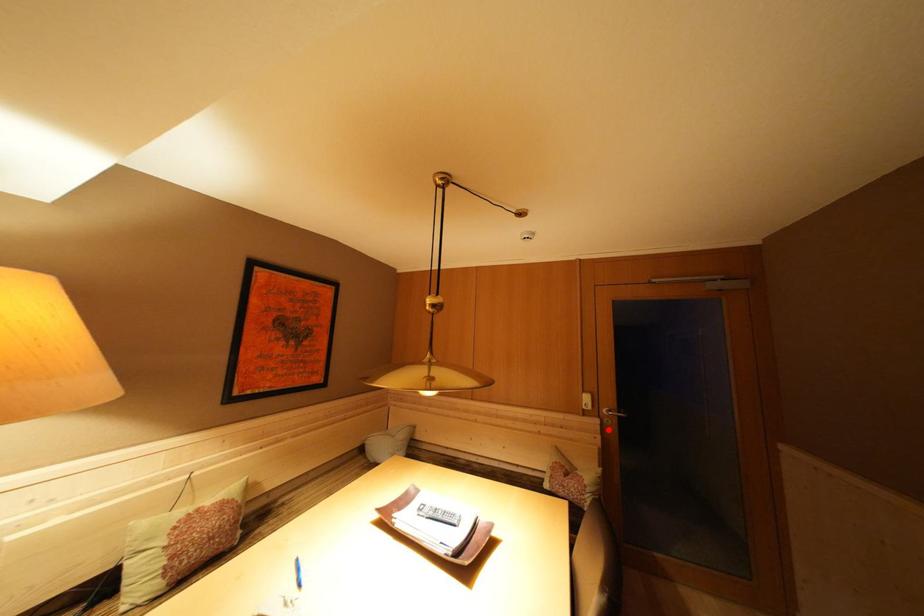
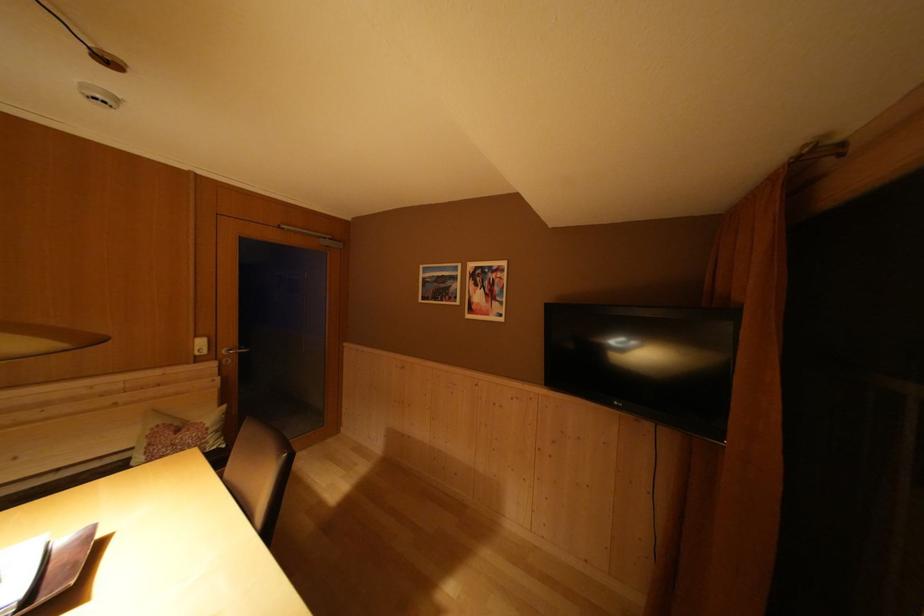
In the second image, find the point that corresponds to the highlighted location in the first image.

(226, 371)